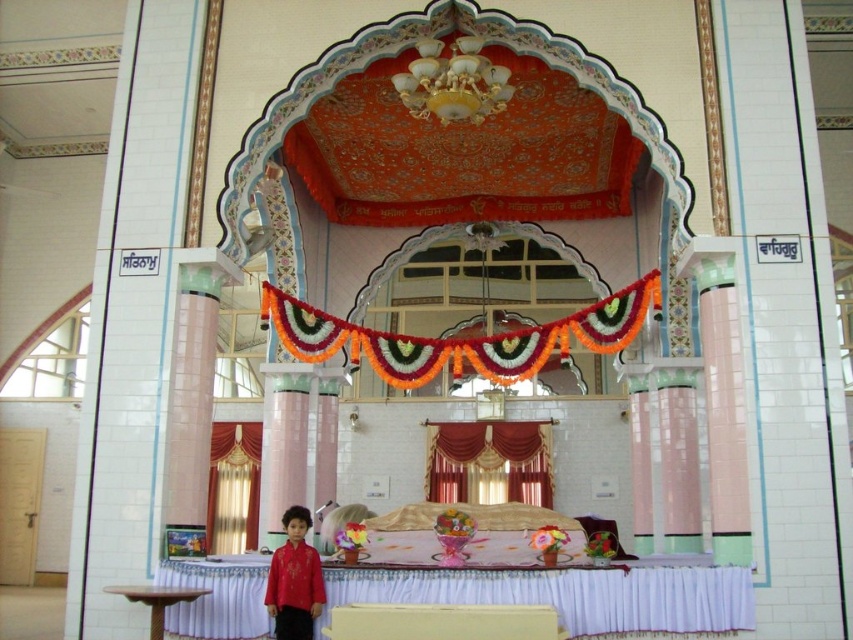
Which is above, velvet red curtain at center or gold velvet curtain at lower center?

Positioned higher is velvet red curtain at center.

This screenshot has width=853, height=640. What do you see at coordinates (490, 461) in the screenshot?
I see `velvet red curtain at center` at bounding box center [490, 461].

Where is `velvet red curtain at center`? Image resolution: width=853 pixels, height=640 pixels. velvet red curtain at center is located at coordinates (490, 461).

Between gold velvet curtain at lower center and matte red shirt at lower center, which one is positioned lower?

gold velvet curtain at lower center is below.

Which is more to the right, gold velvet curtain at lower center or matte red shirt at lower center?

matte red shirt at lower center is more to the right.

At what (x,y) coordinates should I click in order to perform the action: click on gold velvet curtain at lower center. Please return your answer as a coordinate pair (x, y). The width and height of the screenshot is (853, 640). Looking at the image, I should click on (233, 486).

Between velvet red curtain at center and matte red shirt at lower center, which one appears on the left side from the viewer's perspective?

Positioned to the left is matte red shirt at lower center.

Can you confirm if velvet red curtain at center is shorter than matte red shirt at lower center?

Incorrect, velvet red curtain at center's height does not fall short of matte red shirt at lower center's.

Locate an element on the screen. The image size is (853, 640). velvet red curtain at center is located at coordinates (490, 461).

The height and width of the screenshot is (640, 853). Identify the location of velvet red curtain at center. (490, 461).